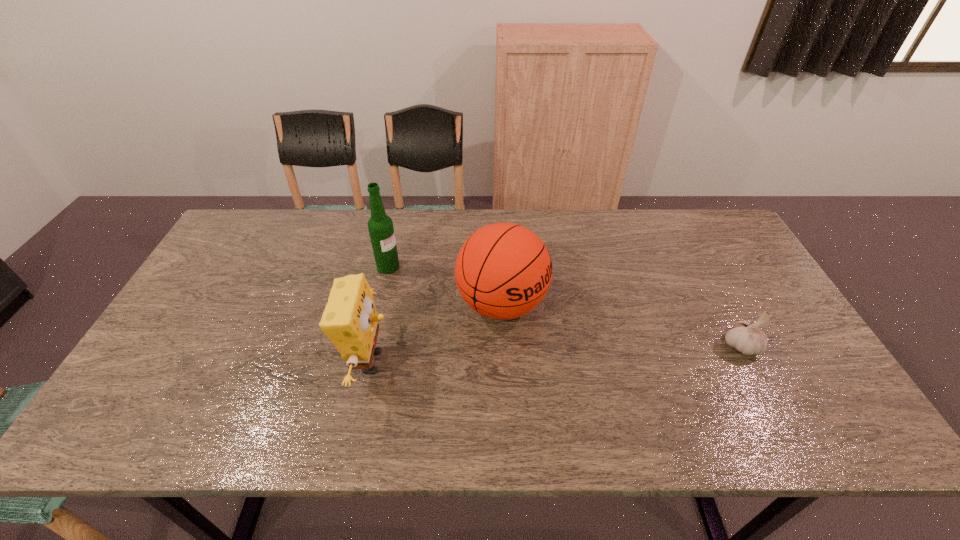
Identify the location of free spot that satisfies the following two spatial constraints: 1. on the front side of the sponge; 2. on the face of the beer bottle. The width and height of the screenshot is (960, 540). (367, 362).

This screenshot has height=540, width=960. Identify the location of free space that satisfies the following two spatial constraints: 1. on the front side of the beer bottle; 2. on the face of the sponge. (367, 362).

Where is `free space that satisfies the following two spatial constraints: 1. on the front side of the sponge; 2. on the face of the beer bottle`? The image size is (960, 540). free space that satisfies the following two spatial constraints: 1. on the front side of the sponge; 2. on the face of the beer bottle is located at coordinates click(367, 362).

Locate an element on the screen. The width and height of the screenshot is (960, 540). vacant space that satisfies the following two spatial constraints: 1. on the front side of the sponge; 2. on the face of the beer bottle is located at coordinates (367, 362).